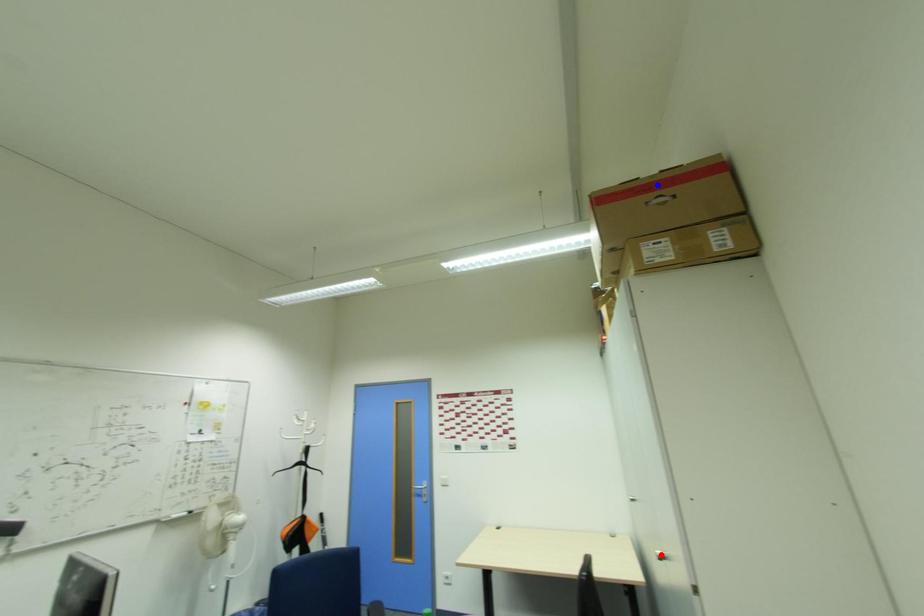
Question: In the image, two points are highlighted. Which point is nearer to the camera? Reply with the corresponding letter.

Choices:
 (A) blue point
 (B) red point

Answer: (B)